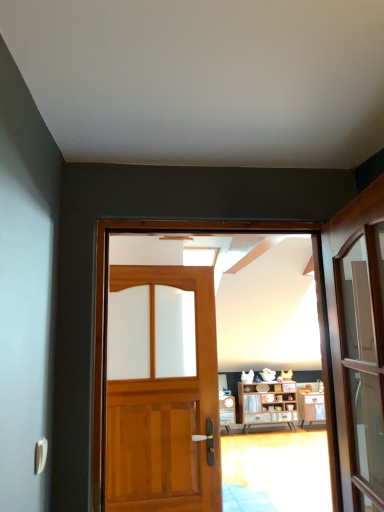
Question: Can we say wooden door at center, the first door in the front-to-back sequence, lies outside wooden door at center, which is counted as the 1th door, starting from the back?

Choices:
 (A) no
 (B) yes

Answer: (B)

Question: Is wooden door at center, the first door in the front-to-back sequence, looking in the opposite direction of wooden door at center, which is counted as the 1th door, starting from the back?

Choices:
 (A) yes
 (B) no

Answer: (A)

Question: Is wooden door at center, positioned as the second door in back-to-front order, further to camera compared to wooden door at center, which is counted as the 1th door, starting from the back?

Choices:
 (A) yes
 (B) no

Answer: (B)

Question: Is wooden door at center, which is the second door from front to back, completely or partially inside wooden door at center, positioned as the second door in back-to-front order?

Choices:
 (A) yes
 (B) no

Answer: (B)

Question: Can you confirm if wooden door at center, the first door in the front-to-back sequence, is taller than wooden door at center, which is the second door from front to back?

Choices:
 (A) no
 (B) yes

Answer: (A)

Question: From a real-world perspective, is wooden door at center, positioned as the second door in back-to-front order, physically below wooden door at center, which is counted as the 1th door, starting from the back?

Choices:
 (A) yes
 (B) no

Answer: (B)

Question: From the image's perspective, would you say wooden cabinet at center is positioned over wooden door at center, which is counted as the 1th door, starting from the back?

Choices:
 (A) yes
 (B) no

Answer: (B)

Question: Can you confirm if wooden cabinet at center is smaller than wooden door at center, which is the second door from front to back?

Choices:
 (A) yes
 (B) no

Answer: (B)

Question: From a real-world perspective, does wooden cabinet at center stand above wooden door at center, which is counted as the 1th door, starting from the back?

Choices:
 (A) yes
 (B) no

Answer: (B)

Question: Considering the relative positions of wooden cabinet at center and wooden door at center, which is the second door from front to back, in the image provided, is wooden cabinet at center to the right of wooden door at center, which is the second door from front to back, from the viewer's perspective?

Choices:
 (A) yes
 (B) no

Answer: (A)

Question: Could you tell me if wooden cabinet at center is turned towards wooden door at center, which is the second door from front to back?

Choices:
 (A) yes
 (B) no

Answer: (A)

Question: Is wooden cabinet at center wider than wooden door at center, which is counted as the 1th door, starting from the back?

Choices:
 (A) yes
 (B) no

Answer: (B)

Question: Is wooden door at center, the first door in the front-to-back sequence, thinner than white glossy door handle at lower left?

Choices:
 (A) no
 (B) yes

Answer: (A)